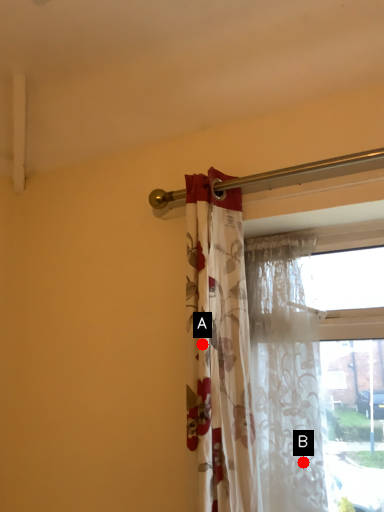
Question: Two points are circled on the image, labeled by A and B beside each circle. Which point is farther to the camera?

Choices:
 (A) A is further
 (B) B is further

Answer: (B)